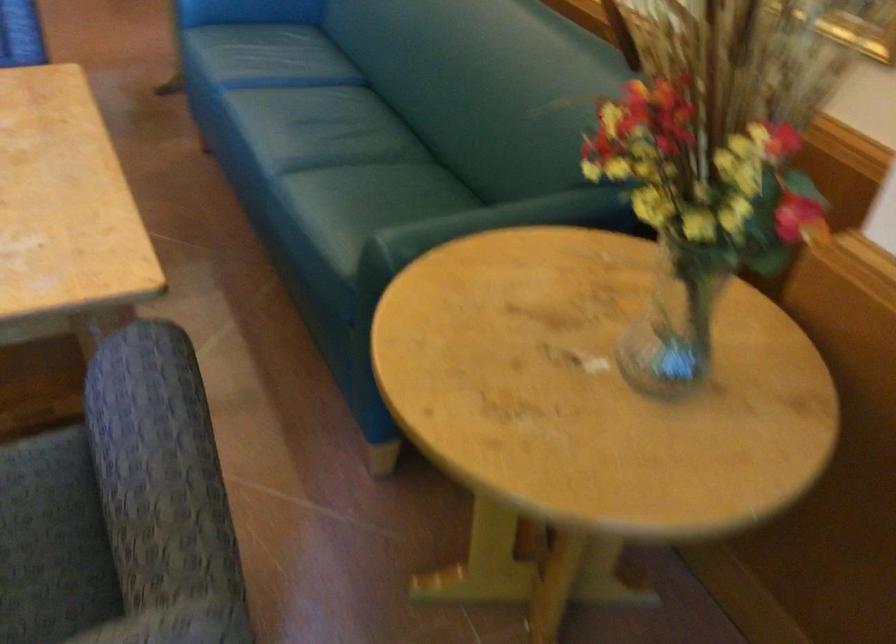
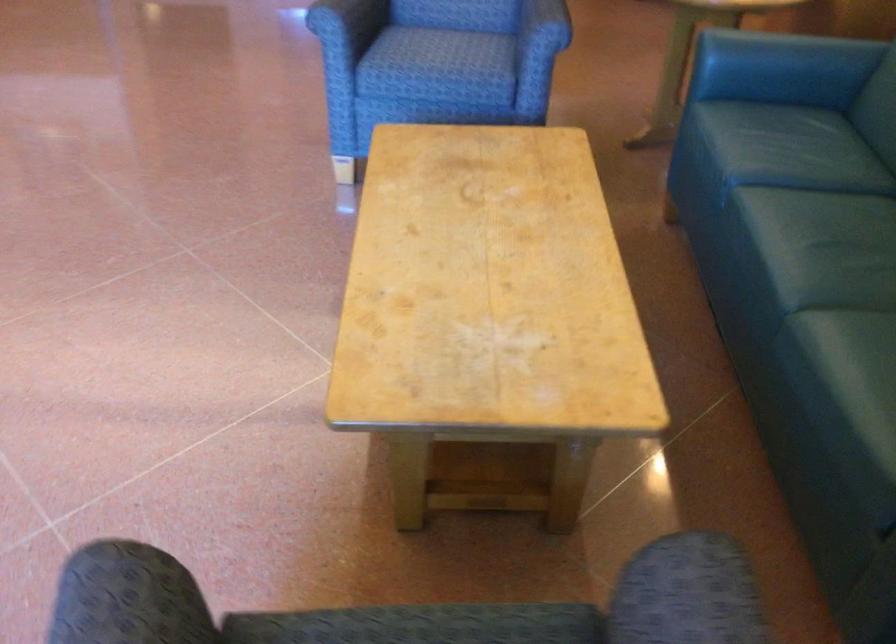
Question: Based on the continuous images, in which direction is the camera rotating? Reply with the corresponding letter.

Choices:
 (A) Left
 (B) Right
 (C) Up
 (D) Down

Answer: (A)